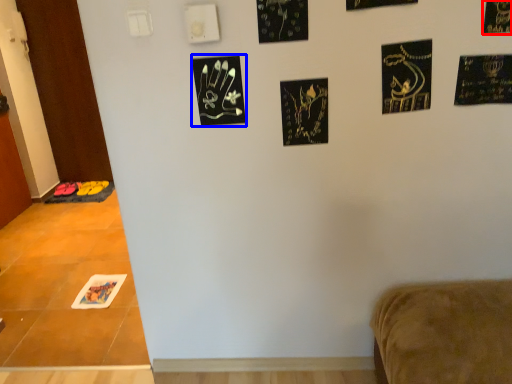
Question: Which of the following is the farthest to the observer, print (highlighted by a red box) or print (highlighted by a blue box)?

Choices:
 (A) print
 (B) print

Answer: (B)